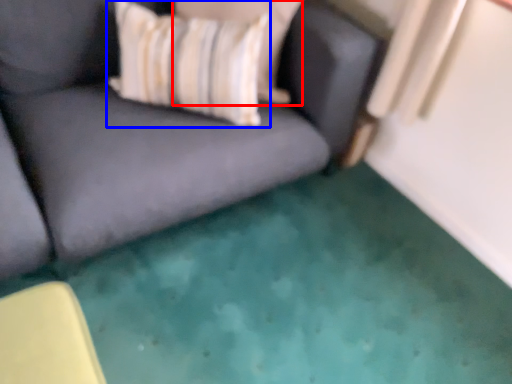
Question: Which of the following is the farthest to the observer, pillow (highlighted by a red box) or throw pillow (highlighted by a blue box)?

Choices:
 (A) pillow
 (B) throw pillow

Answer: (A)